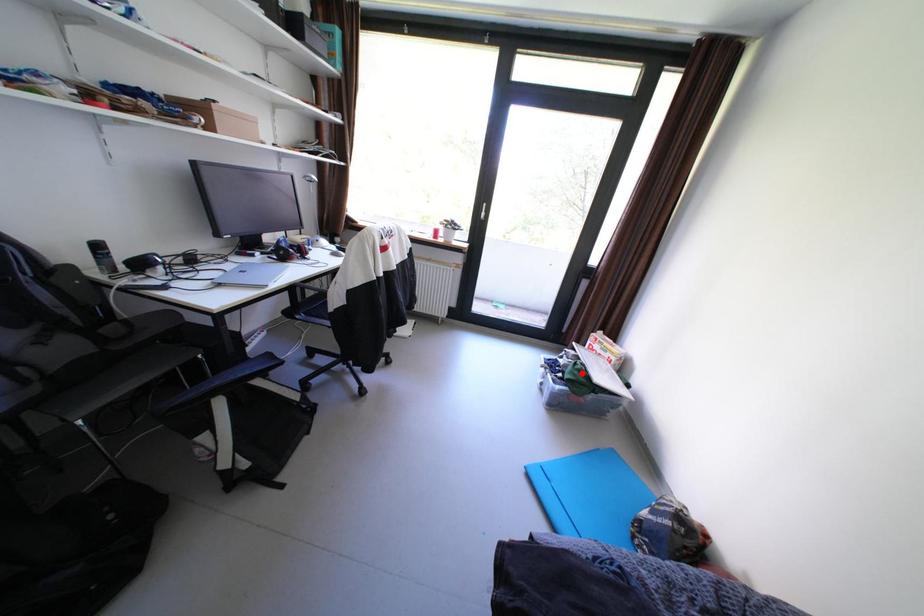
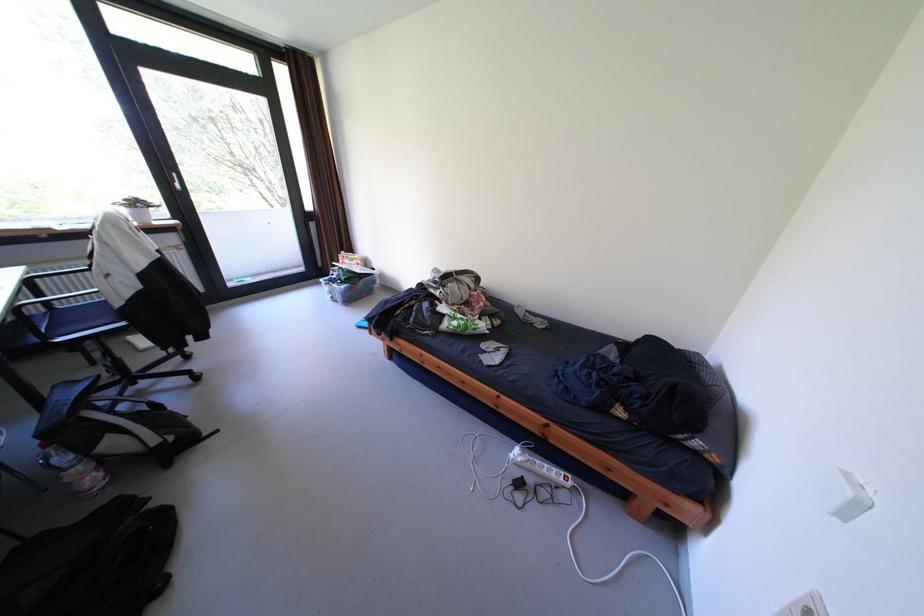
Question: A red point is marked in image1. In image2, is the corresponding 3D point closer to the camera or farther? Reply with the corresponding letter.

Choices:
 (A) The corresponding 3D point is closer.
 (B) The corresponding 3D point is farther.

Answer: (A)